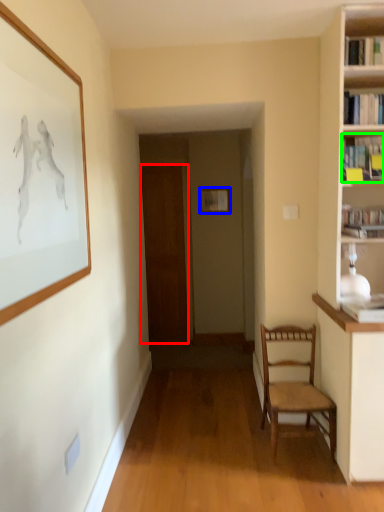
Question: Which object is positioned farthest from door (highlighted by a red box)? Select from picture frame (highlighted by a blue box) and book (highlighted by a green box).

Choices:
 (A) picture frame
 (B) book

Answer: (B)